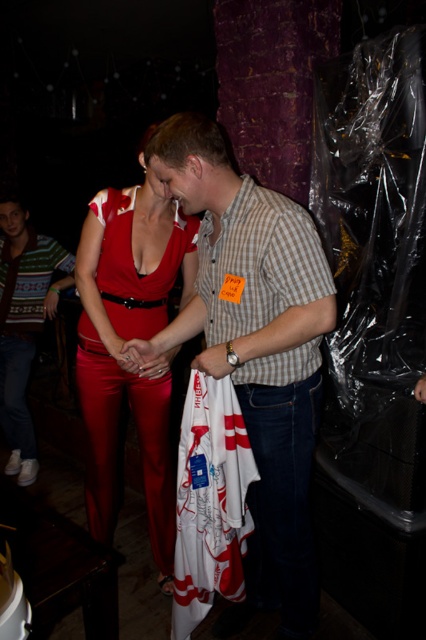
Between shiny red jumpsuit at center and striped knit sweater at left, which one appears on the left side from the viewer's perspective?

striped knit sweater at left

Between point (111, 268) and point (51, 291), which one is positioned behind?

The point (51, 291) is more distant.

I want to click on shiny red jumpsuit at center, so click(x=127, y=339).

Describe the element at coordinates (258, 262) in the screenshot. The image size is (426, 640). I see `brown checkered shirt at center` at that location.

Who is positioned more to the left, brown checkered shirt at center or matte red pants at center?

From the viewer's perspective, matte red pants at center appears more on the left side.

Does point (287, 282) come behind point (149, 342)?

No, it is not.

What are the coordinates of `brown checkered shirt at center` in the screenshot? It's located at (258, 262).

Is matte red dress at center below matte red pants at center?

Correct, matte red dress at center is located below matte red pants at center.

Between matte red dress at center and matte red pants at center, which one has less height?

matte red pants at center

Is point (307, 502) positioned before point (135, 355)?

Yes, point (307, 502) is closer to viewer.

Image resolution: width=426 pixels, height=640 pixels. Find the location of `matte red dress at center`. matte red dress at center is located at coordinates (256, 349).